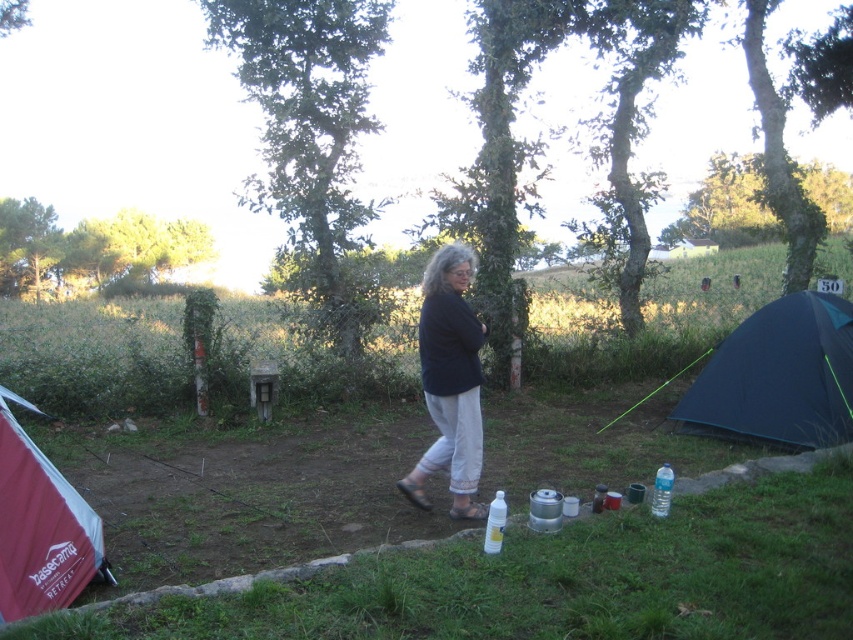
Consider the image. You are a hiker who wants to set up a tent in the camping area. You have a dark blue fabric tent at right and a black cotton shirt at center in your backpack. Based on the scene description, which item is shorter in height?

The dark blue fabric tent at right is not as tall as the black cotton shirt at center, so the tent is shorter in height.

You are a hiker who needs to choose between the transparent plastic bottle at lower center and the clear plastic bottle at lower center to carry water. Which one can hold more water?

The clear plastic bottle at lower center has a greater width than the transparent plastic bottle at lower center, so it can hold more water.

You are a hiker who wants to store your transparent plastic bottle at lower center near the red fabric tent at lower left. Since the tent is larger, will it block the bottle from being seen from the path? Please explain.

The red fabric tent at lower left is larger than the transparent plastic bottle at lower center, so the tent may block the bottle from view depending on their exact positions. However, since the bottle is at lower center and the tent is at lower left, they are positioned apart. The bottle might still be visible unless the tent is directly in front of it.